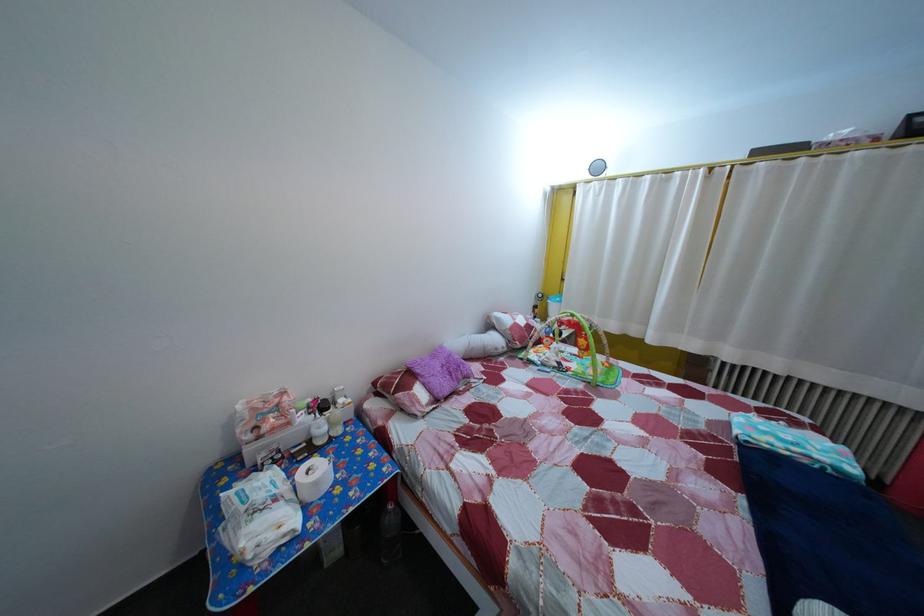
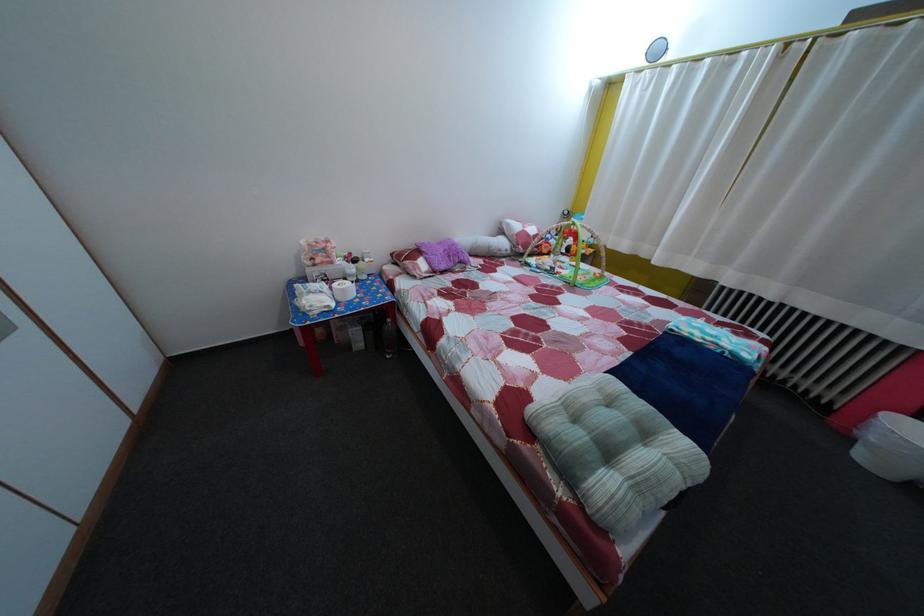
The point at (288, 459) is marked in the first image. Where is the corresponding point in the second image?

(335, 284)